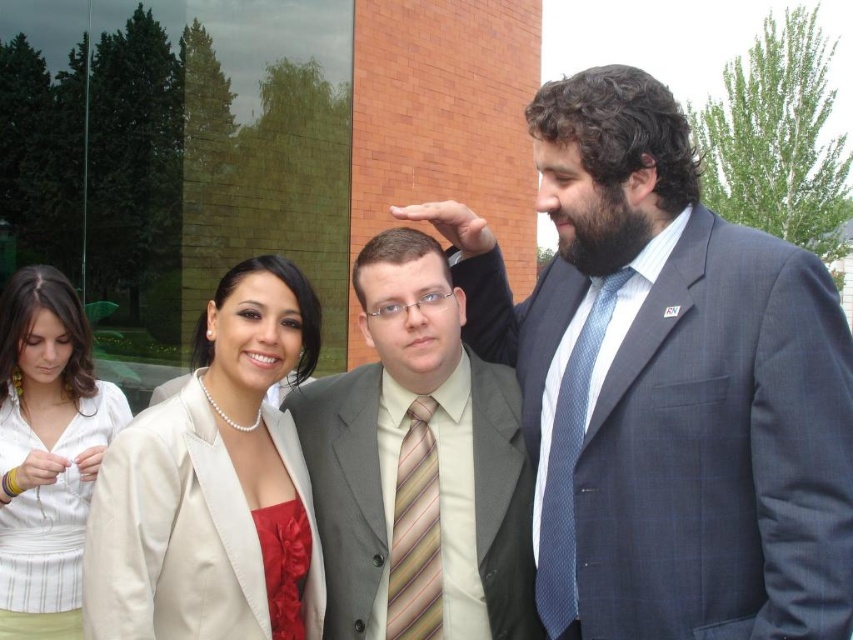
You are an event planner organizing a photoshoot for a fashion magazine. You need to decide the placement of two key items in the scene for a closeup shot. The blue textured tie at center and the silky satin dress at center are both focal points. Based on their positions and sizes, which item should be placed closer to the camera to maintain visual balance?

The blue textured tie at center has a greater height compared to the silky satin dress at center. To maintain visual balance, the shorter silky satin dress at center should be placed closer to the camera while the taller blue textured tie at center can be positioned slightly farther back.

You are a photographer at a corporate event and need to capture a photo of the blue textured tie at center and the silky satin dress at center. Which one is on the right side when viewed from the front?

The blue textured tie at center is positioned on the right side of the silky satin dress at center, so the blue textured tie at center is on the right when viewed from the front.